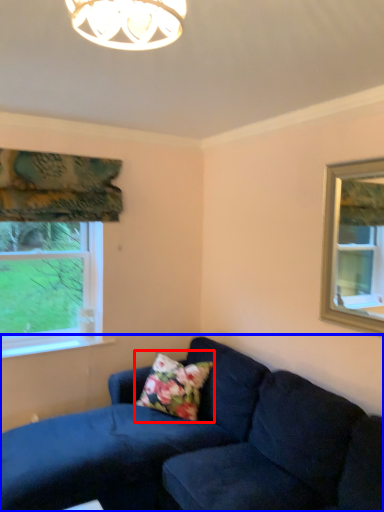
Question: Which object appears farthest to the camera in this image, pillow (highlighted by a red box) or studio couch (highlighted by a blue box)?

Choices:
 (A) pillow
 (B) studio couch

Answer: (A)